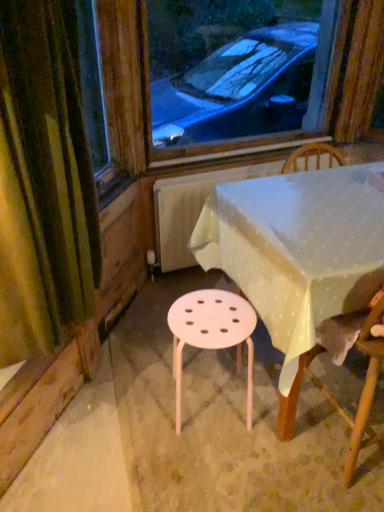
Question: Is green fabric curtain at left positioned in front of white plastic table at center?

Choices:
 (A) yes
 (B) no

Answer: (A)

Question: Is green fabric curtain at left oriented away from white plastic table at center?

Choices:
 (A) no
 (B) yes

Answer: (A)

Question: Considering the relative positions of green fabric curtain at left and white plastic table at center in the image provided, is green fabric curtain at left behind white plastic table at center?

Choices:
 (A) no
 (B) yes

Answer: (A)

Question: Considering the relative sizes of green fabric curtain at left and white plastic table at center in the image provided, is green fabric curtain at left taller than white plastic table at center?

Choices:
 (A) yes
 (B) no

Answer: (A)

Question: From the image's perspective, is green fabric curtain at left located above white plastic table at center?

Choices:
 (A) no
 (B) yes

Answer: (B)

Question: Is wooden chair at lower right in front of or behind pink plastic stool at center in the image?

Choices:
 (A) front
 (B) behind

Answer: (A)

Question: Is point (289, 410) closer or farther from the camera than point (215, 340)?

Choices:
 (A) closer
 (B) farther

Answer: (B)

Question: Is wooden chair at lower right taller or shorter than pink plastic stool at center?

Choices:
 (A) tall
 (B) short

Answer: (A)

Question: In the image, is wooden chair at lower right on the left side or the right side of pink plastic stool at center?

Choices:
 (A) left
 (B) right

Answer: (B)

Question: From a real-world perspective, relative to wooden chair at lower right, is green fabric curtain at left vertically above or below?

Choices:
 (A) above
 (B) below

Answer: (A)

Question: Relative to wooden chair at lower right, is green fabric curtain at left in front or behind?

Choices:
 (A) behind
 (B) front

Answer: (B)

Question: Would you say green fabric curtain at left is inside or outside wooden chair at lower right?

Choices:
 (A) outside
 (B) inside

Answer: (A)

Question: Looking at their shapes, would you say green fabric curtain at left is wider or thinner than wooden chair at lower right?

Choices:
 (A) thin
 (B) wide

Answer: (A)

Question: From their relative heights in the image, would you say green fabric curtain at left is taller or shorter than white plastic table at center?

Choices:
 (A) tall
 (B) short

Answer: (A)

Question: From the image's perspective, relative to white plastic table at center, is green fabric curtain at left above or below?

Choices:
 (A) above
 (B) below

Answer: (A)